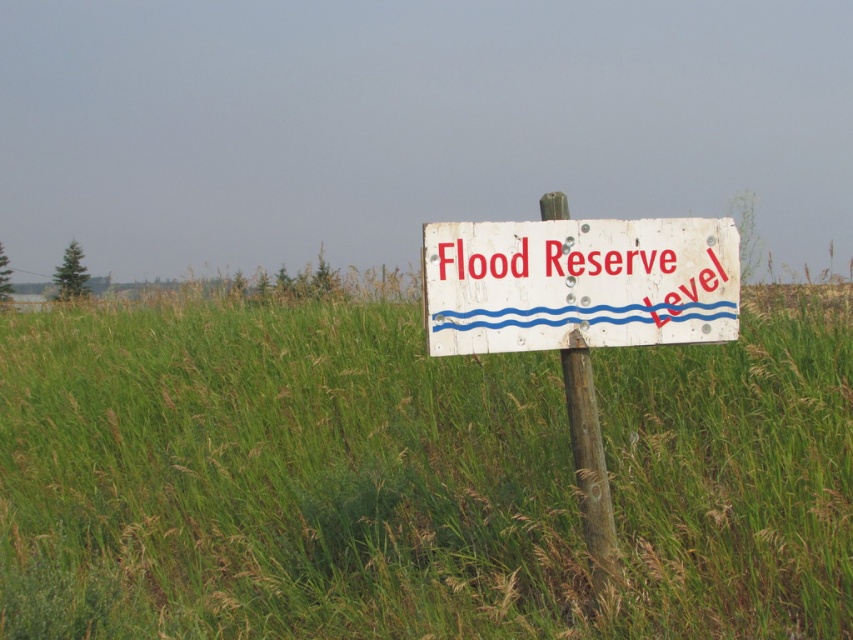
You are standing in a wetland area and see the green grassy at center and the white wooden sign at center. Which object is closer to you?

The green grassy at center is closer to you because it is further to the viewer than the white wooden sign at center.

You are a hiker who wants to place a 1.5 meter long hiking pole between the green grassy at center and the white wooden sign at center. Can the pole fit horizontally between them?

The green grassy at center is narrower than the white wooden sign at center. Since the pole is 1.5 meters long, it depends on the combined width of both objects. However, without knowing their exact widths, we cannot determine if the pole will fit. Please provide more details about their individual widths.

You are standing in front of the flood reserve level signpost in the grassy area. There are two points marked on the signpost. The first point is at coordinates point (851, 554) and the second point is at point (428, 330). Which point is closer to you?

Point (851, 554) is further to the viewer than point (428, 330), so the point closer to you is point (428, 330).